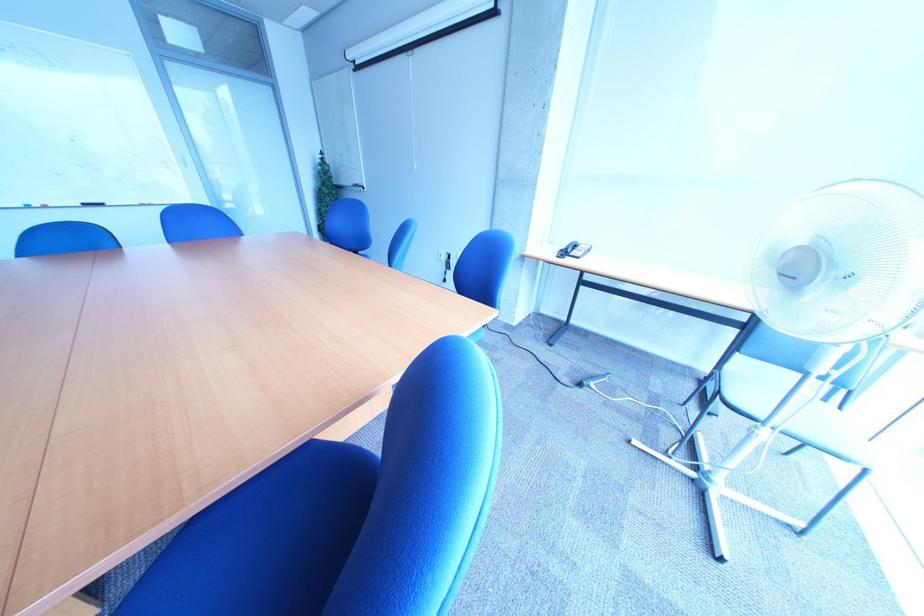
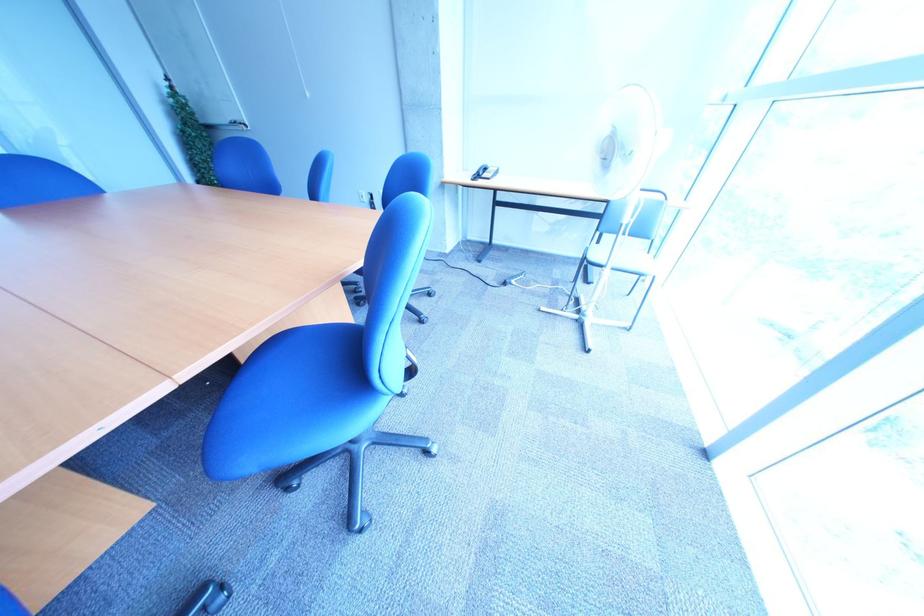
The point at [646,444] is marked in the first image. Where is the corresponding point in the second image?

(554, 312)